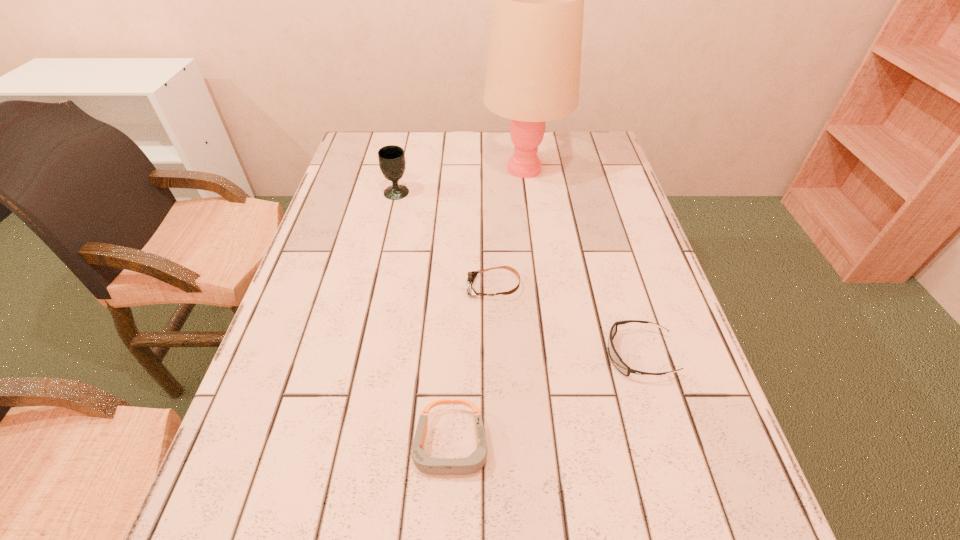
The width and height of the screenshot is (960, 540). In order to click on vacant space that satisfies the following two spatial constraints: 1. on the front side of the lampshade; 2. on the front-facing side of the third farthest object in this screenshot , I will do `click(540, 287)`.

Image resolution: width=960 pixels, height=540 pixels. I want to click on blank area in the image that satisfies the following two spatial constraints: 1. on the front-facing side of the farthest goggles; 2. on the front and back of the nearest object, so click(498, 446).